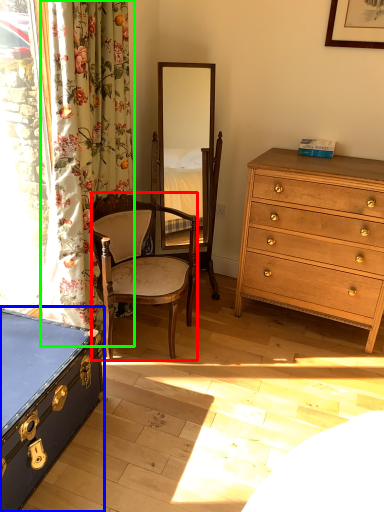
Question: Which is farther away from chair (highlighted by a red box)? box (highlighted by a blue box) or curtain (highlighted by a green box)?

Choices:
 (A) box
 (B) curtain

Answer: (A)